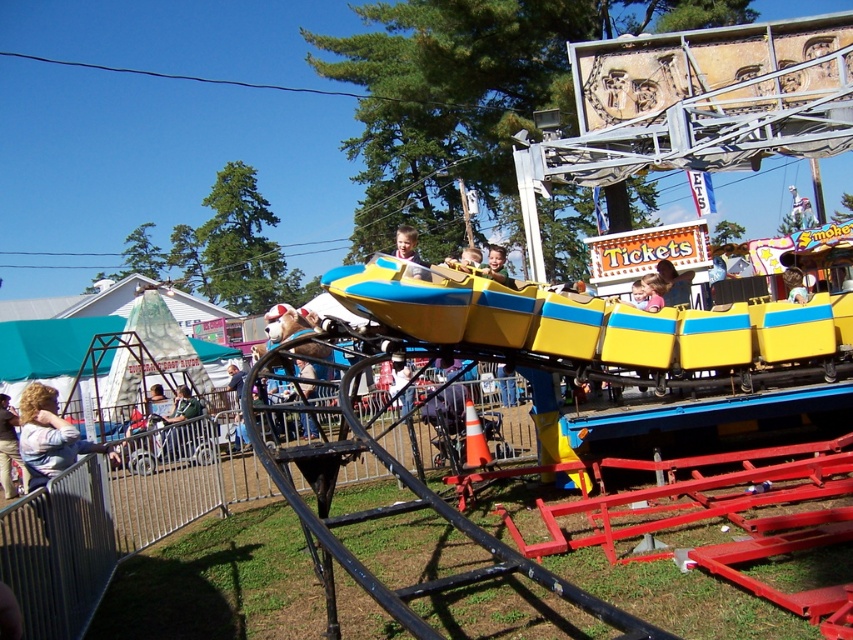
Question: Which object appears closest to the camera in this image?

Choices:
 (A) yellow plastic roller coaster at center
 (B) smooth yellow helmet at center

Answer: (A)

Question: Which object appears farthest from the camera in this image?

Choices:
 (A) green fabric jacket at center
 (B) light brown leather jacket at lower left
 (C) yellow plastic roller coaster at center

Answer: (B)

Question: Does yellow plastic roller coaster at center appear on the right side of green fabric jacket at center?

Choices:
 (A) no
 (B) yes

Answer: (B)

Question: Which point is closer to the camera?

Choices:
 (A) light brown leather jacket at lower left
 (B) smooth yellow helmet at center
 (C) yellow plastic helmet at center
 (D) light brown hair at lower left

Answer: (B)

Question: Can you confirm if yellow plastic roller coaster at center is positioned to the left of green fabric jacket at center?

Choices:
 (A) yes
 (B) no

Answer: (B)

Question: From the image, what is the correct spatial relationship of light brown hair at lower left in relation to green fabric jacket at center?

Choices:
 (A) above
 (B) below

Answer: (A)